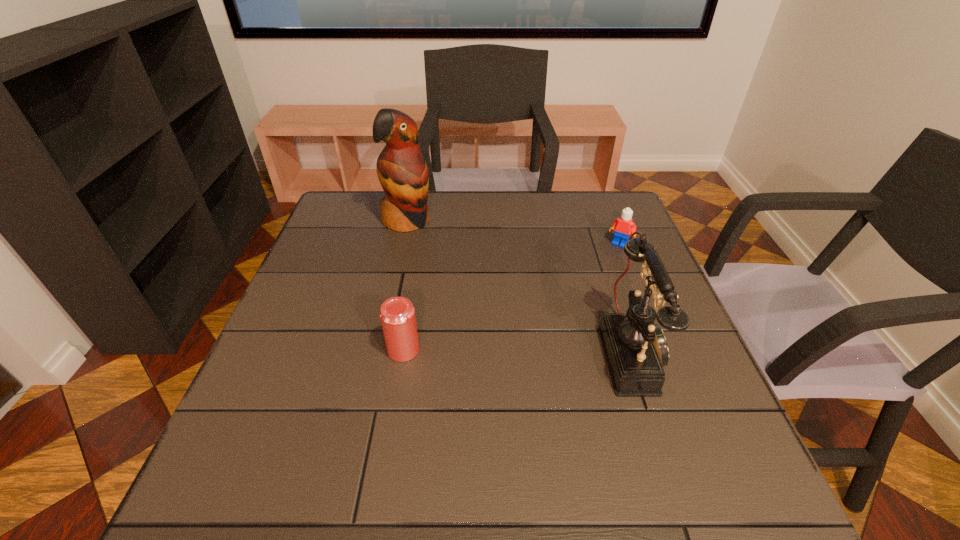
In order to click on free space on the desktop that is between the beer can and the second tallest object and is positioned on the face of the tallest object in this screenshot , I will do `click(527, 351)`.

Where is `free space on the desktop that is between the beer can and the second tallest object and is positioned on the face of the Lego`? free space on the desktop that is between the beer can and the second tallest object and is positioned on the face of the Lego is located at coordinates (551, 351).